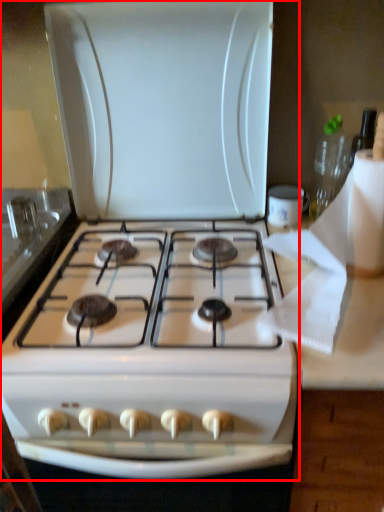
Question: From the image's perspective, what is the correct spatial relationship of gas stove (annotated by the red box) in relation to toilet paper?

Choices:
 (A) above
 (B) below

Answer: (B)